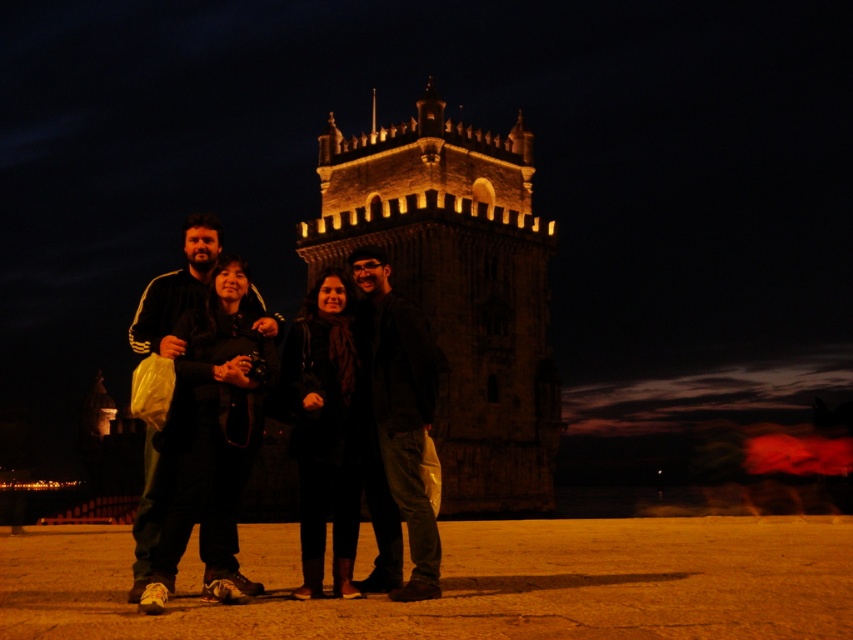
Is dark gray jacket at center to the right of black fabric coat at center from the viewer's perspective?

Correct, you'll find dark gray jacket at center to the right of black fabric coat at center.

Who is positioned more to the left, dark gray jacket at center or black fabric coat at center?

black fabric coat at center is more to the left.

Is point (392, 436) farther from camera compared to point (206, 221)?

No, (392, 436) is closer to viewer.

The width and height of the screenshot is (853, 640). I want to click on dark gray jacket at center, so click(395, 429).

This screenshot has height=640, width=853. Find the location of `black fabric coat at center`. black fabric coat at center is located at coordinates (177, 289).

Does black fabric coat at center appear on the right side of black athletic wear at left?

Yes, black fabric coat at center is to the right of black athletic wear at left.

The height and width of the screenshot is (640, 853). What do you see at coordinates (177, 289) in the screenshot? I see `black fabric coat at center` at bounding box center [177, 289].

Locate an element on the screen. This screenshot has width=853, height=640. black fabric coat at center is located at coordinates (177, 289).

Can you confirm if black matte coat at center is smaller than black athletic wear at left?

Indeed, black matte coat at center has a smaller size compared to black athletic wear at left.

Based on the photo, who is shorter, black matte coat at center or black athletic wear at left?

black matte coat at center

Find the location of a particular element. The width and height of the screenshot is (853, 640). black matte coat at center is located at coordinates (323, 432).